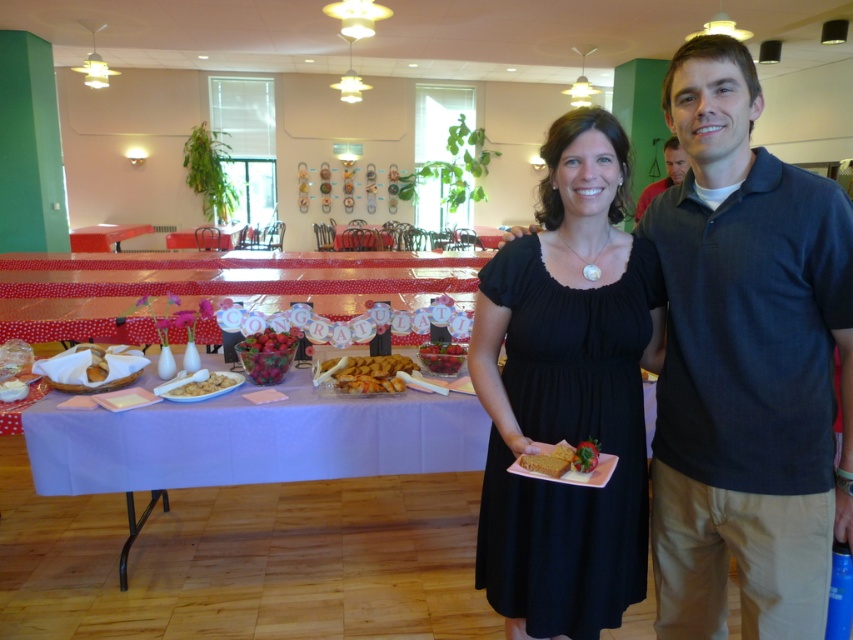
You are planning to serve drinks at a party and need to place a tray of beverages between the red glossy strawberries at center and the wooden table at center. The tray requires 3 feet of space. Is there enough space between them to accommodate the tray?

The red glossy strawberries at center and wooden table at center are 22.55 feet apart, so yes, there is enough space between them to place the tray of beverages since the required space is only 3 feet.

You are at a party and want to grab a strawberry from the red glossy strawberries at center and place it on the wooden table at center. Which direction should you move the strawberry to reach the table?

The red glossy strawberries at center are to the right of the wooden table at center, so you should move the strawberry to the left to reach the table.